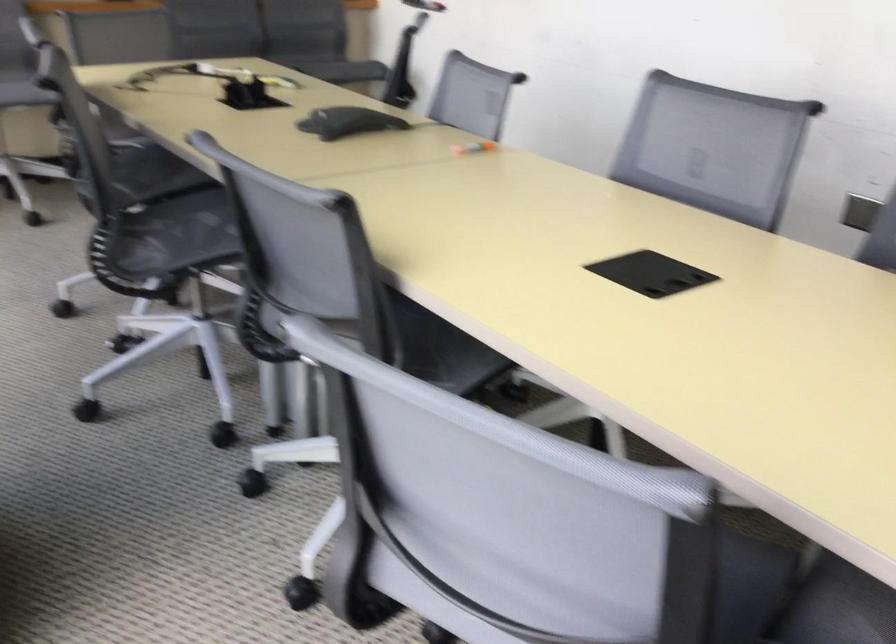
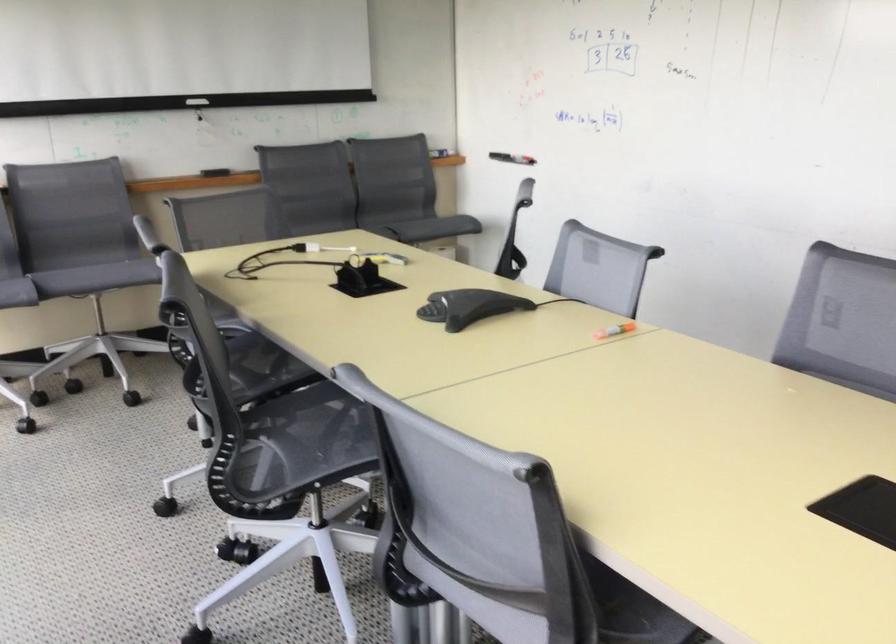
The images are taken continuously from a first-person perspective. In which direction are you moving?

→ The cameraman moved toward left, forward.